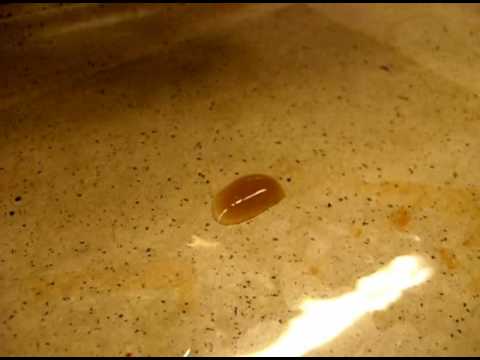
I want to click on specks on countertop, so click(x=327, y=203), click(x=16, y=202), click(x=383, y=68), click(x=273, y=241).